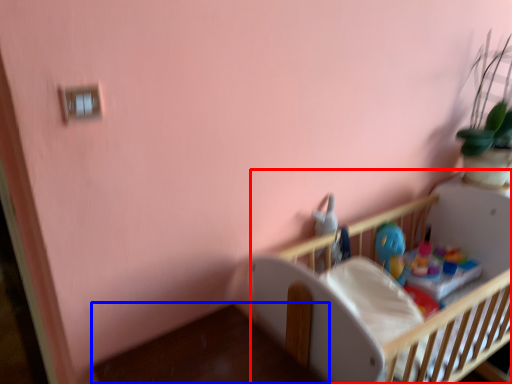
Question: Which of the following is the closest to the observer, infant bed (highlighted by a red box) or table (highlighted by a blue box)?

Choices:
 (A) infant bed
 (B) table

Answer: (B)